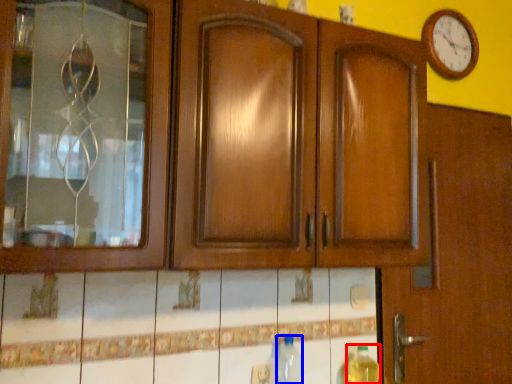
Question: Which point is closer to the camera, bottle (highlighted by a red box) or bottle (highlighted by a blue box)?

Choices:
 (A) bottle
 (B) bottle

Answer: (B)